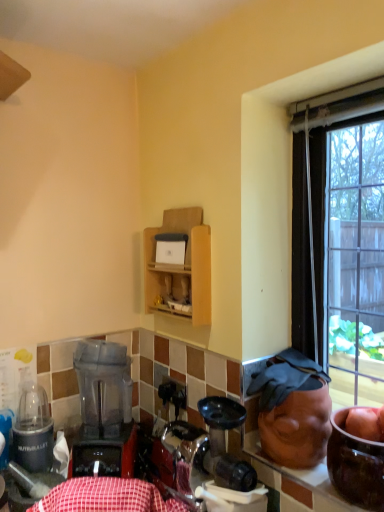
Question: Considering the relative sizes of red checkered tablecloth at lower center and translucent plastic blender at lower left in the image provided, is red checkered tablecloth at lower center shorter than translucent plastic blender at lower left?

Choices:
 (A) yes
 (B) no

Answer: (A)

Question: From a real-world perspective, is red checkered tablecloth at lower center on translucent plastic blender at lower left?

Choices:
 (A) yes
 (B) no

Answer: (B)

Question: From the image's perspective, is red checkered tablecloth at lower center on top of translucent plastic blender at lower left?

Choices:
 (A) no
 (B) yes

Answer: (A)

Question: Is translucent plastic blender at lower left at the back of red checkered tablecloth at lower center?

Choices:
 (A) yes
 (B) no

Answer: (A)

Question: Can you confirm if red checkered tablecloth at lower center is thinner than translucent plastic blender at lower left?

Choices:
 (A) no
 (B) yes

Answer: (B)

Question: Considering the relative sizes of red checkered tablecloth at lower center and translucent plastic blender at lower left in the image provided, is red checkered tablecloth at lower center wider than translucent plastic blender at lower left?

Choices:
 (A) no
 (B) yes

Answer: (A)

Question: Can you confirm if red checkered tablecloth at lower center is shorter than wooden cabinet at upper center?

Choices:
 (A) yes
 (B) no

Answer: (A)

Question: Does red checkered tablecloth at lower center contain wooden cabinet at upper center?

Choices:
 (A) yes
 (B) no

Answer: (B)

Question: Can you confirm if red checkered tablecloth at lower center is wider than wooden cabinet at upper center?

Choices:
 (A) yes
 (B) no

Answer: (A)

Question: Is red checkered tablecloth at lower center thinner than wooden cabinet at upper center?

Choices:
 (A) no
 (B) yes

Answer: (A)

Question: Is the surface of red checkered tablecloth at lower center in direct contact with wooden cabinet at upper center?

Choices:
 (A) yes
 (B) no

Answer: (B)

Question: Is red checkered tablecloth at lower center bigger than wooden cabinet at upper center?

Choices:
 (A) yes
 (B) no

Answer: (A)

Question: From a real-world perspective, is red checkered tablecloth at lower center beneath metallic silver blender at left?

Choices:
 (A) no
 (B) yes

Answer: (B)